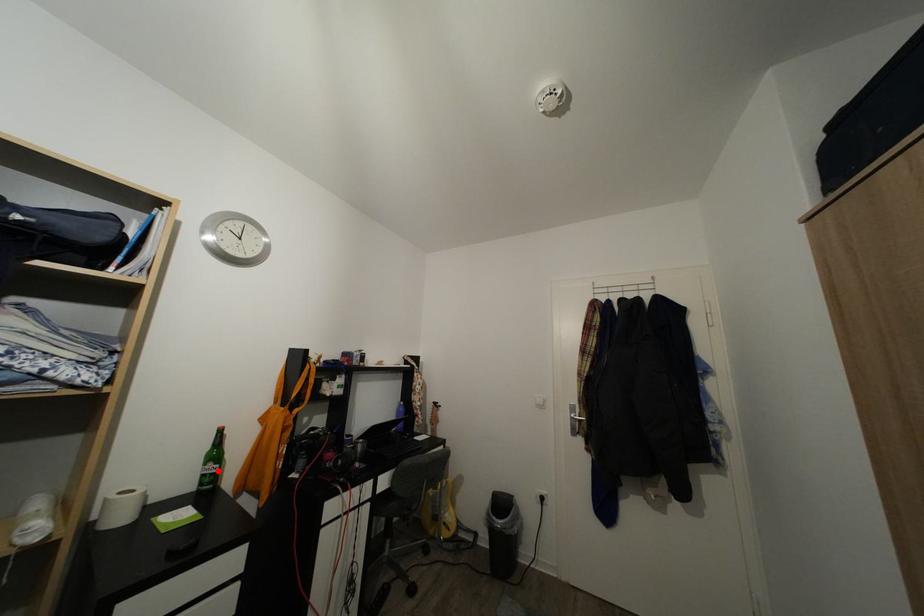
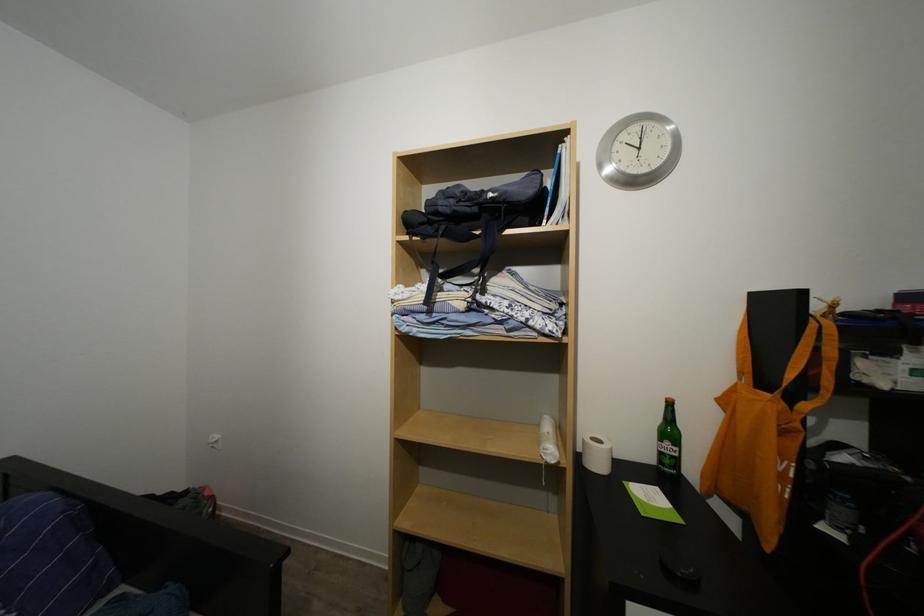
Where in the second image is the point corresponding to the highlighted location from the first image?

(675, 450)